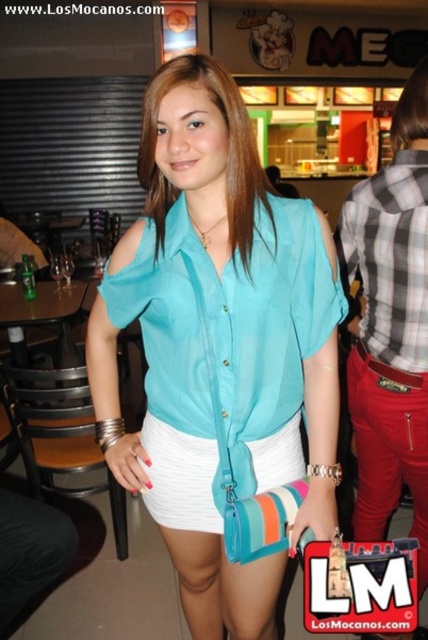
Looking at this image, is matte blue blouse at center positioned behind plaid fabric shirt at right?

That is False.

From the picture: Between matte blue blouse at center and plaid fabric shirt at right, which one appears on the right side from the viewer's perspective?

Positioned to the right is plaid fabric shirt at right.

Who is more distant from viewer, (219,605) or (425,259)?

Point (219,605)

The image size is (428, 640). In order to click on matte blue blouse at center in this screenshot , I will do `click(219, 340)`.

Is point (407, 262) positioned in front of point (412, 176)?

Yes.

Which is behind, point (416, 369) or point (401, 168)?

Positioned behind is point (416, 369).

The height and width of the screenshot is (640, 428). Find the location of `plaid fabric shirt at right`. plaid fabric shirt at right is located at coordinates (391, 324).

Find the location of a particular element. The height and width of the screenshot is (640, 428). plaid fabric shirt at right is located at coordinates (391, 324).

Can you confirm if matte blue blouse at center is positioned to the left of plaid cotton shirt at right?

Correct, you'll find matte blue blouse at center to the left of plaid cotton shirt at right.

Who is shorter, matte blue blouse at center or plaid cotton shirt at right?

Standing shorter between the two is plaid cotton shirt at right.

Where is `matte blue blouse at center`? This screenshot has height=640, width=428. matte blue blouse at center is located at coordinates (219, 340).